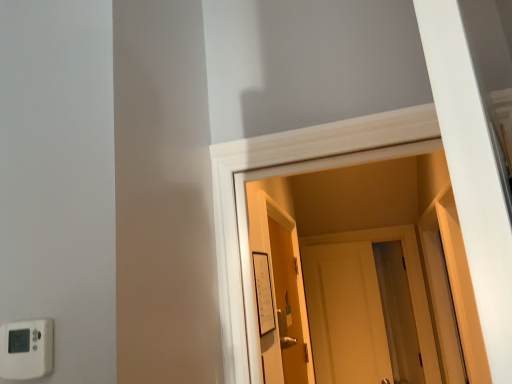
Question: Is there a large distance between white plastic thermostat at lower left, positioned as the 1th light switch in left-to-right order, and white paper at center, the 2th light switch in the left-to-right sequence?

Choices:
 (A) no
 (B) yes

Answer: (B)

Question: Is white plastic thermostat at lower left, positioned as the 1th light switch in left-to-right order, placed right next to white paper at center, which is counted as the 2th light switch, starting from the front?

Choices:
 (A) yes
 (B) no

Answer: (B)

Question: Considering the relative sizes of white plastic thermostat at lower left, the second light switch in the right-to-left sequence, and white paper at center, which is counted as the 2th light switch, starting from the front, in the image provided, is white plastic thermostat at lower left, the second light switch in the right-to-left sequence, thinner than white paper at center, which is counted as the 2th light switch, starting from the front,?

Choices:
 (A) no
 (B) yes

Answer: (A)

Question: From a real-world perspective, is white plastic thermostat at lower left, the second light switch in the right-to-left sequence, over white paper at center, which is counted as the 2th light switch, starting from the front?

Choices:
 (A) yes
 (B) no

Answer: (B)

Question: Does white plastic thermostat at lower left, the second light switch in the right-to-left sequence, appear on the left side of white paper at center, the 1th light switch viewed from the back?

Choices:
 (A) no
 (B) yes

Answer: (B)

Question: Considering their positions, is white matte door at center, which is the 1th door from back to front, located in front of or behind white plastic thermostat at lower left, the second light switch positioned from the back?

Choices:
 (A) behind
 (B) front

Answer: (A)

Question: Does point (342, 233) appear closer or farther from the camera than point (6, 359)?

Choices:
 (A) farther
 (B) closer

Answer: (A)

Question: Is white matte door at center, which is the second door in front-to-back order, wider or thinner than white plastic thermostat at lower left, the second light switch positioned from the back?

Choices:
 (A) thin
 (B) wide

Answer: (B)

Question: From the image's perspective, is white matte door at center, which is the second door in front-to-back order, positioned above or below white plastic thermostat at lower left, the second light switch in the right-to-left sequence?

Choices:
 (A) above
 (B) below

Answer: (B)

Question: From the image's perspective, relative to white matte door at center, which is the 1th door from back to front, is wooden door at center, the second door positioned from the right, above or below?

Choices:
 (A) above
 (B) below

Answer: (A)

Question: Would you say wooden door at center, placed as the second door when sorted from back to front, is to the left or to the right of white matte door at center, which is the 1th door from back to front, in the picture?

Choices:
 (A) right
 (B) left

Answer: (B)

Question: Relative to white matte door at center, acting as the 2th door starting from the left, is wooden door at center, marked as the 1th door in a left-to-right arrangement, in front or behind?

Choices:
 (A) front
 (B) behind

Answer: (A)

Question: From a real-world perspective, relative to white matte door at center, which is the 1th door from back to front, is wooden door at center, marked as the 1th door in a left-to-right arrangement, vertically above or below?

Choices:
 (A) above
 (B) below

Answer: (A)

Question: In terms of width, does white paper at center, the 2th light switch in the left-to-right sequence, look wider or thinner when compared to wooden door at center, marked as the 1th door in a left-to-right arrangement?

Choices:
 (A) wide
 (B) thin

Answer: (B)

Question: Is white paper at center, acting as the first light switch starting from the right, taller or shorter than wooden door at center, placed as the second door when sorted from back to front?

Choices:
 (A) tall
 (B) short

Answer: (B)